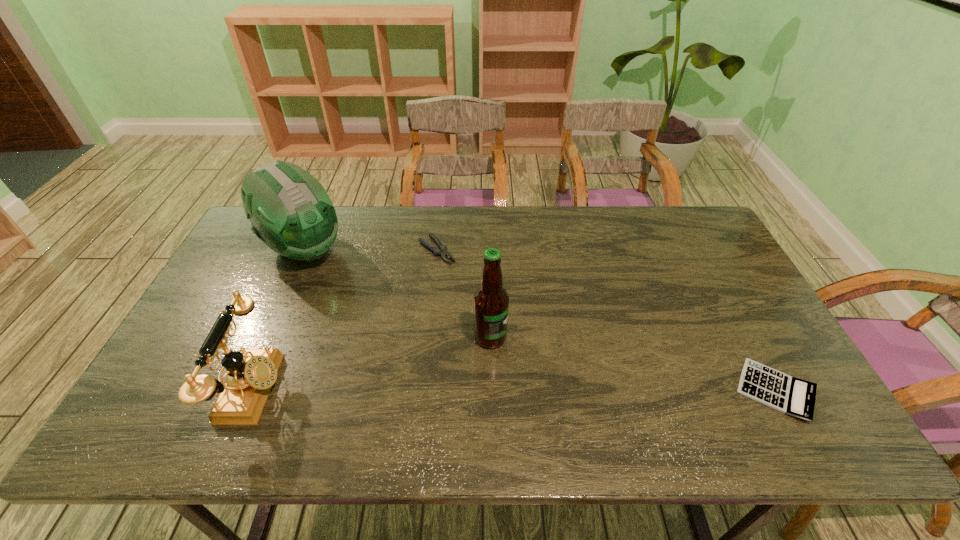
Where is `vacant space positioned on the visor of the football helmet`? vacant space positioned on the visor of the football helmet is located at coordinates coord(347,286).

Identify the location of vacant point located 0.270m on the visor of the football helmet. (381, 315).

Identify the location of free space located 0.240m on the visor of the football helmet. This screenshot has width=960, height=540. (374, 309).

I want to click on vacant space situated at the gripping part of the pliers, so click(x=529, y=337).

Locate an element on the screen. The height and width of the screenshot is (540, 960). free space located 0.370m at the gripping part of the pliers is located at coordinates (527, 335).

The image size is (960, 540). Find the location of `free region located 0.310m at the gripping part of the pliers`. free region located 0.310m at the gripping part of the pliers is located at coordinates (513, 321).

You are a GUI agent. You are given a task and a screenshot of the screen. Output one action in this format:
    pyautogui.click(x=<x>, y=<y>)
    Task: Click on the football helmet situated at the far edge
    
    Given the screenshot: What is the action you would take?
    pyautogui.click(x=290, y=211)

The width and height of the screenshot is (960, 540). What are the coordinates of `pliers situated at the far edge` in the screenshot? It's located at (441, 251).

The image size is (960, 540). Find the location of `telephone that is positioned at the near edge`. telephone that is positioned at the near edge is located at coordinates (251, 373).

Find the location of a particular element. calculator situated at the near edge is located at coordinates 795,397.